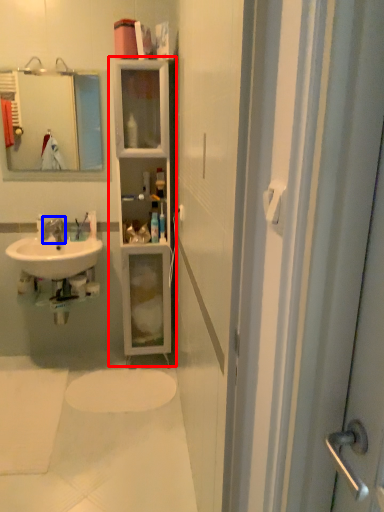
Question: Which of the following is the closest to the observer, bathroom cabinet (highlighted by a red box) or tap (highlighted by a blue box)?

Choices:
 (A) bathroom cabinet
 (B) tap

Answer: (A)